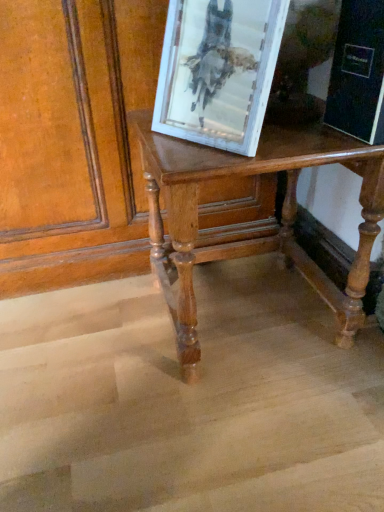
Find the location of a particular element. The image size is (384, 512). vacant region to the left of shiny polished wood table at center is located at coordinates (85, 343).